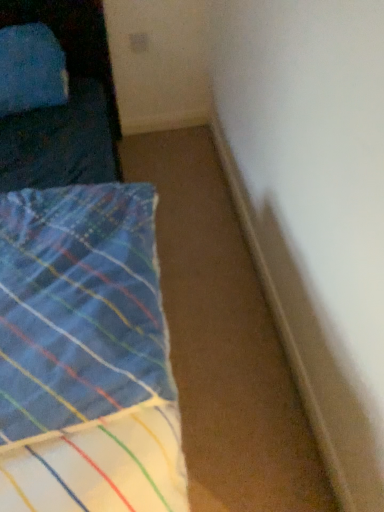
Question: Is blue plaid fabric at left looking in the opposite direction of blue fabric pillow at upper left?

Choices:
 (A) yes
 (B) no

Answer: (A)

Question: Can we say blue plaid fabric at left lies outside blue fabric pillow at upper left?

Choices:
 (A) no
 (B) yes

Answer: (B)

Question: Is blue plaid fabric at left in front of blue fabric pillow at upper left?

Choices:
 (A) yes
 (B) no

Answer: (A)

Question: From a real-world perspective, is blue plaid fabric at left below blue fabric pillow at upper left?

Choices:
 (A) no
 (B) yes

Answer: (B)

Question: Considering the relative sizes of blue plaid fabric at left and blue fabric pillow at upper left in the image provided, is blue plaid fabric at left wider than blue fabric pillow at upper left?

Choices:
 (A) yes
 (B) no

Answer: (A)

Question: Does blue plaid fabric at left turn towards blue fabric pillow at upper left?

Choices:
 (A) no
 (B) yes

Answer: (A)

Question: Can you confirm if blue fabric pillow at upper left is bigger than blue plaid fabric at left?

Choices:
 (A) yes
 (B) no

Answer: (B)

Question: Does blue fabric pillow at upper left have a greater height compared to blue plaid fabric at left?

Choices:
 (A) yes
 (B) no

Answer: (A)

Question: From the image's perspective, does blue fabric pillow at upper left appear higher than blue plaid fabric at left?

Choices:
 (A) no
 (B) yes

Answer: (B)

Question: Is blue fabric pillow at upper left further to camera compared to blue plaid fabric at left?

Choices:
 (A) no
 (B) yes

Answer: (B)

Question: From a real-world perspective, does blue fabric pillow at upper left stand above blue plaid fabric at left?

Choices:
 (A) yes
 (B) no

Answer: (A)

Question: Is blue fabric pillow at upper left oriented away from blue plaid fabric at left?

Choices:
 (A) no
 (B) yes

Answer: (A)

Question: Is blue plaid fabric at left taller or shorter than blue fabric pillow at upper left?

Choices:
 (A) tall
 (B) short

Answer: (B)